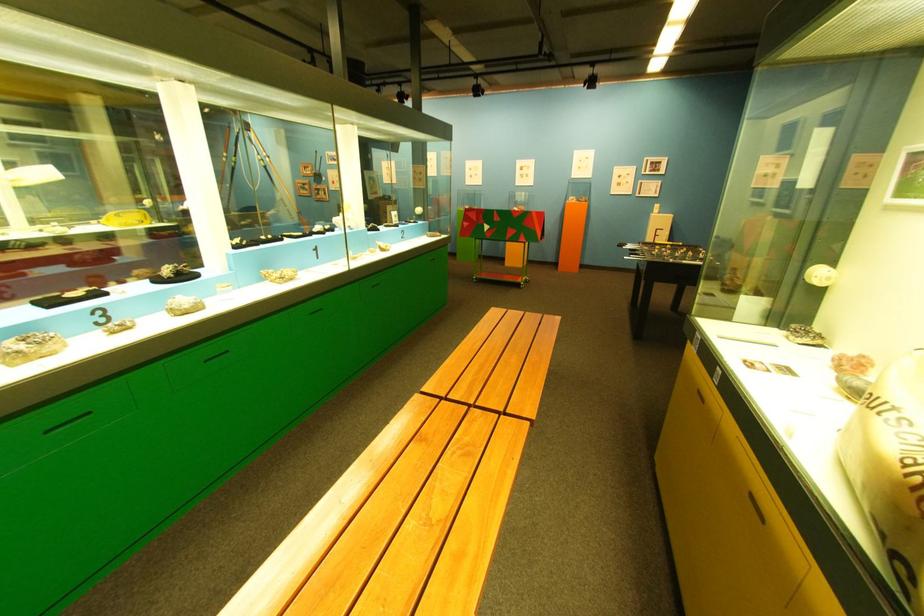
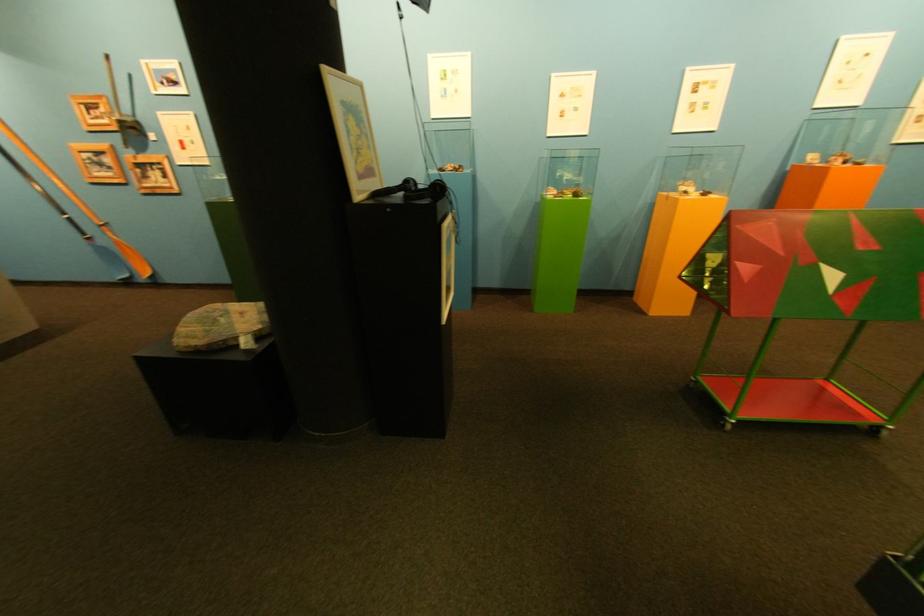
Locate, in the second image, the point that corresponds to point (325, 169) in the first image.

(118, 111)